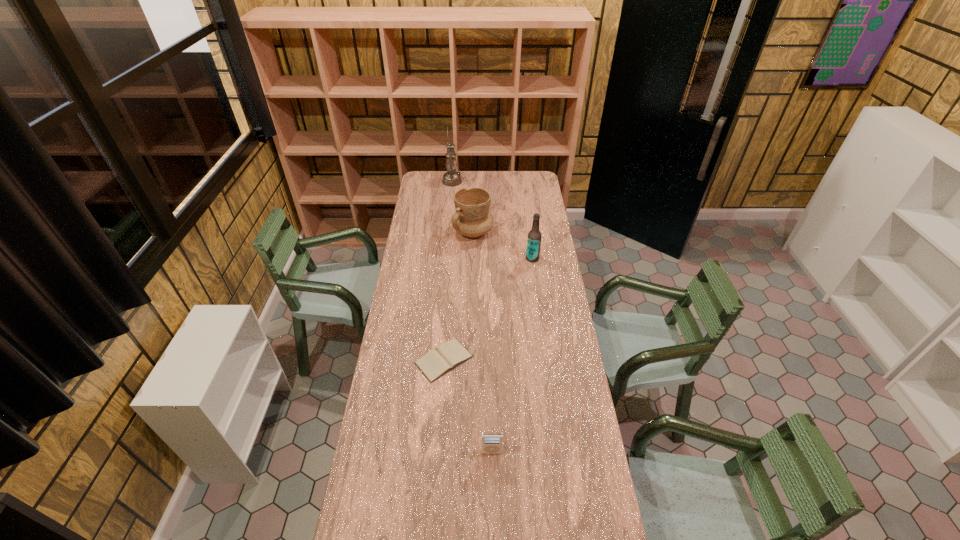
At what (x,y) coordinates should I click in order to perform the action: click on the tallest object. Please return your answer as a coordinate pair (x, y). This screenshot has height=540, width=960. Looking at the image, I should click on (451, 178).

Where is `oil lamp`? This screenshot has width=960, height=540. oil lamp is located at coordinates (451, 178).

Identify the location of the rightmost object. The image size is (960, 540). (534, 236).

Identify the location of the third farthest object. Image resolution: width=960 pixels, height=540 pixels. (534, 236).

You are a GUI agent. You are given a task and a screenshot of the screen. Output one action in this format:
    pyautogui.click(x=<x>, y=<y>)
    Task: Click on the pottery
    
    Given the screenshot: What is the action you would take?
    pyautogui.click(x=472, y=218)

Locate an element on the screen. This screenshot has height=540, width=960. iPod is located at coordinates (491, 442).

Where is `the second shortest object`? the second shortest object is located at coordinates (491, 442).

The image size is (960, 540). What are the coordinates of `Bible` in the screenshot? It's located at (437, 362).

I want to click on the shortest object, so click(x=437, y=362).

Locate an element on the screen. blank space located on the right of the oil lamp is located at coordinates (482, 181).